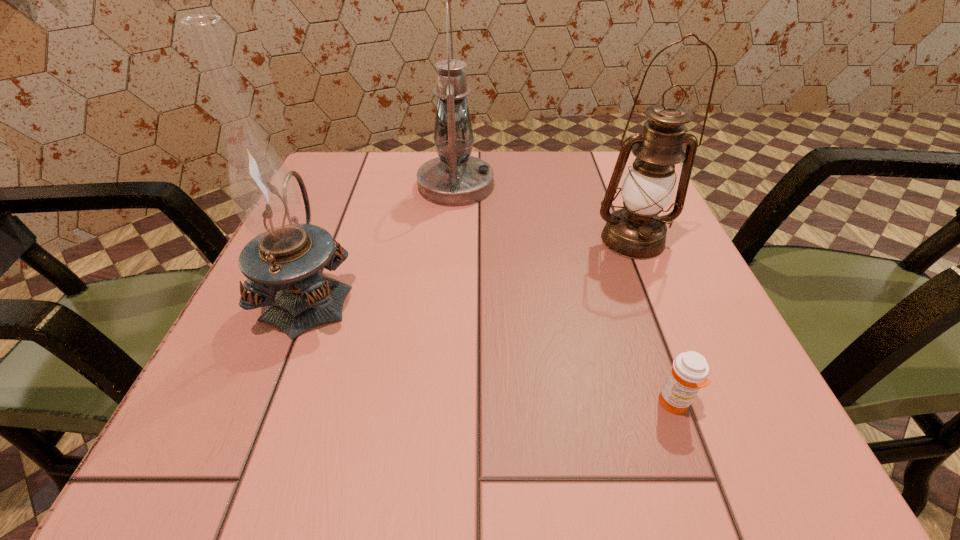
The height and width of the screenshot is (540, 960). Identify the location of vacant space at the far left corner of the desktop. tap(357, 167).

Image resolution: width=960 pixels, height=540 pixels. Find the location of `vacant space at the near left corner of the desktop`. vacant space at the near left corner of the desktop is located at coordinates (197, 429).

You are a GUI agent. You are given a task and a screenshot of the screen. Output one action in this format:
    pyautogui.click(x=<x>, y=<y>)
    Task: Click on the vacant point at the far right corner
    
    Given the screenshot: What is the action you would take?
    pyautogui.click(x=587, y=174)

The width and height of the screenshot is (960, 540). In order to click on vacant space at the near right corner of the desktop in this screenshot , I will do `click(686, 414)`.

Locate an element on the screen. The width and height of the screenshot is (960, 540). free space between the farthest oil lamp and the medicine is located at coordinates point(564,294).

Locate an element on the screen. The image size is (960, 540). vacant area that lies between the rightmost oil lamp and the farthest object is located at coordinates (544, 213).

Where is `unoccupied area between the leftmost object and the second object from left to right`? The image size is (960, 540). unoccupied area between the leftmost object and the second object from left to right is located at coordinates (383, 240).

You are a GUI agent. You are given a task and a screenshot of the screen. Output one action in this format:
    pyautogui.click(x=<x>, y=<y>)
    Task: Click on the blank region between the farthest object and the leftmost object
    Image resolution: width=960 pixels, height=540 pixels.
    Given the screenshot: What is the action you would take?
    pyautogui.click(x=383, y=240)

This screenshot has width=960, height=540. Identify the location of free space between the medicine and the second oil lamp from left to right. (564, 294).

You are a GUI agent. You are given a task and a screenshot of the screen. Output one action in this format:
    pyautogui.click(x=<x>, y=<y>)
    Task: Click on the free space between the leftmost object and the shortest object
    Image resolution: width=960 pixels, height=540 pixels.
    Given the screenshot: What is the action you would take?
    pyautogui.click(x=492, y=349)